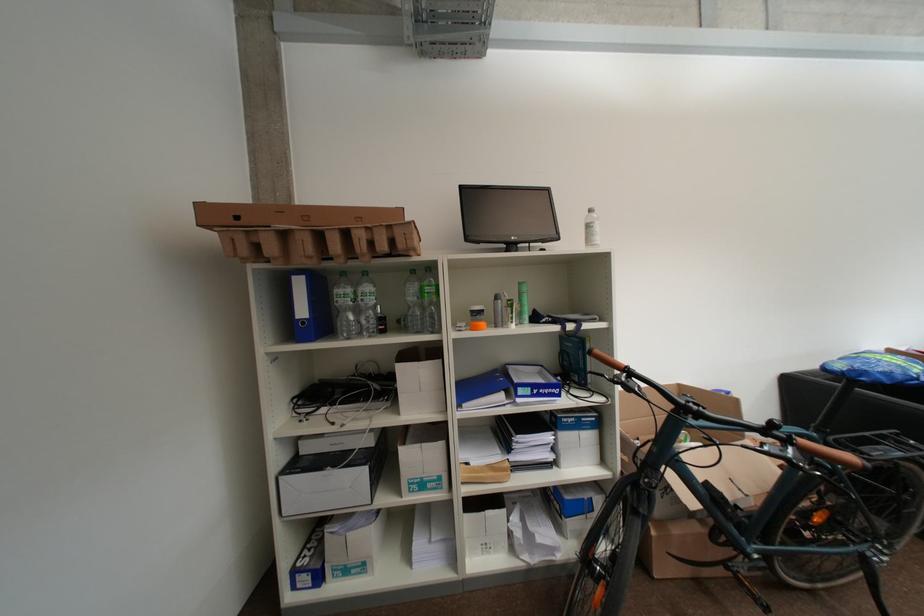
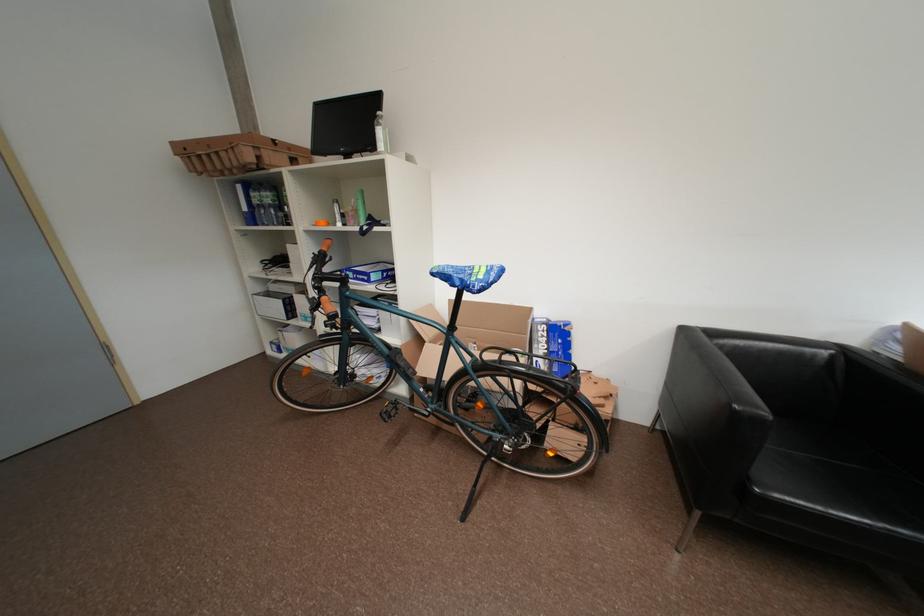
Find the pixel in the second image that matches point (529, 308) in the first image.

(363, 213)